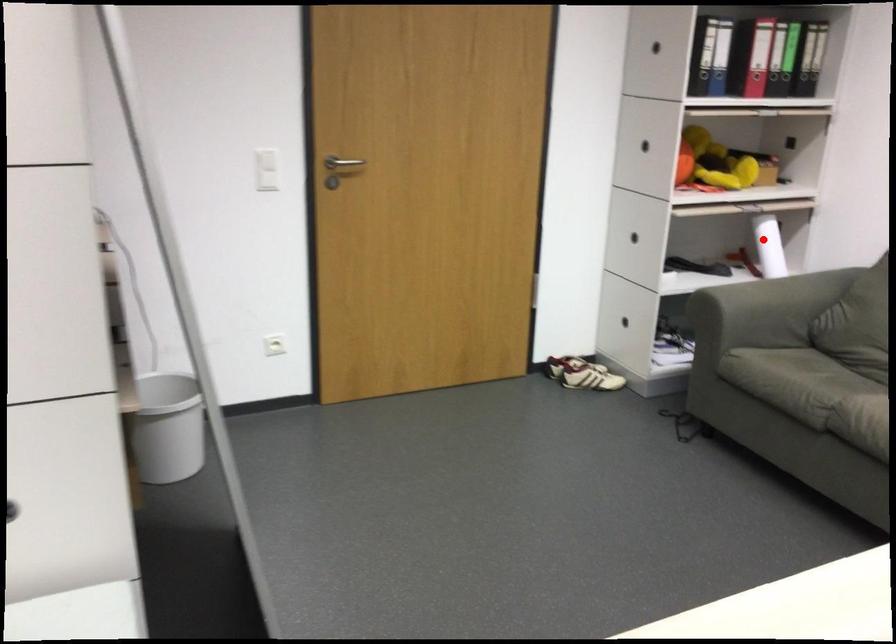
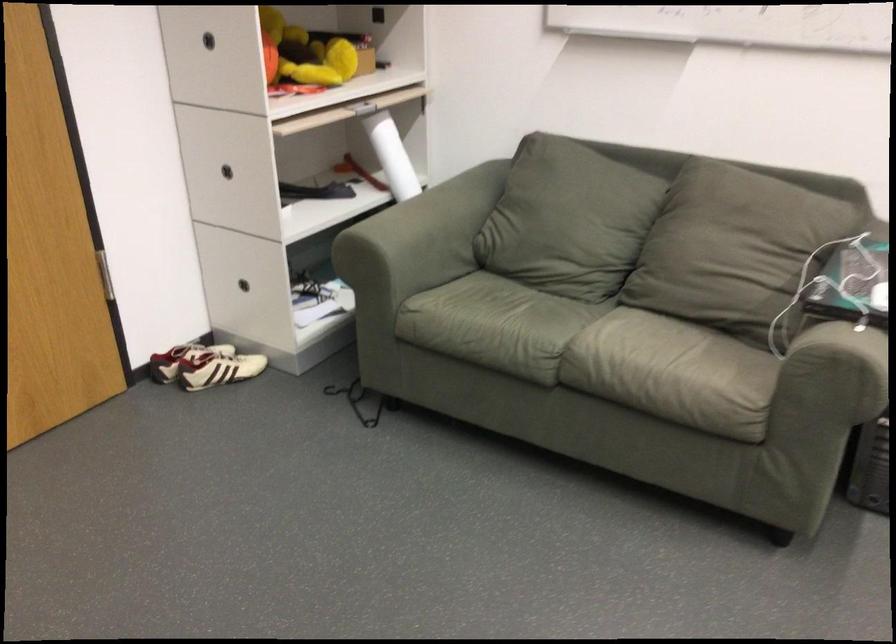
Question: I am providing you with two images of the same scene from different viewpoints. Given a red point in image1, look at the same physical point in image2. Is it:

Choices:
 (A) Closer to the viewpoint
 (B) Farther from the viewpoint

Answer: (A)